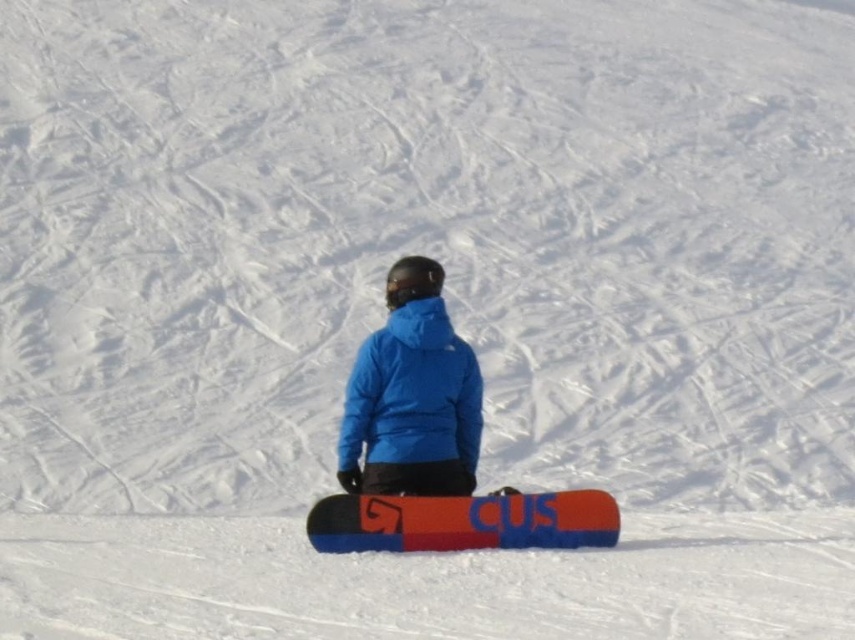
You are a photographer trying to capture the snowboarder and the snowboard in the image. You want to focus on the point closer to the camera. Which point should you choose between point (x=394, y=378) and point (x=464, y=499)?

Point (x=394, y=378) is further to the camera than point (x=464, y=499), so you should focus on point (x=394, y=378) to capture the subject closer to the camera.

You are a photographer trying to capture a wide shot of the blue matte snowboarder at center and the blue synthetic jacket at center. Based on their sizes, which one would appear wider in the photo?

The blue matte snowboarder at center appears wider in the photo because its width surpasses that of the blue synthetic jacket at center.

You are a photographer trying to capture the blue synthetic jacket at center in your shot. The camera is positioned at point A, and you can adjust the focus point to any coordinate on the image. What coordinates should you set the focus point to ensure the jacket is in focus?

The blue synthetic jacket at center is located at point (411,394), so set the focus point to those coordinates to ensure the jacket is in focus.